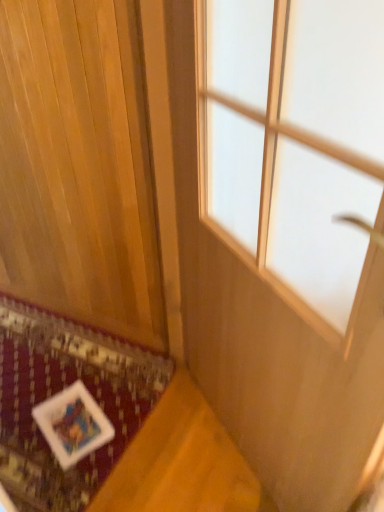
You are a GUI agent. You are given a task and a screenshot of the screen. Output one action in this format:
    pyautogui.click(x=<x>, y=<y>)
    Task: Click on the transparent glass window at center
    The image size is (384, 512).
    Given the screenshot: What is the action you would take?
    pyautogui.click(x=294, y=137)

In order to click on transparent glass window at center in this screenshot , I will do `click(294, 137)`.

Is white fabric mat at lower left smaller than transparent glass window at center?

Correct, white fabric mat at lower left occupies less space than transparent glass window at center.

Based on their positions, is white fabric mat at lower left located to the left or right of transparent glass window at center?

white fabric mat at lower left is positioned on transparent glass window at center's left side.

Is point (106, 343) positioned behind point (221, 2)?

Yes, it is.

Is transparent glass window at center surrounded by white fabric mat at lower left?

No.

Considering the sizes of objects white fabric mat at lower left and wooden panel at lower left in the image provided, who is bigger, white fabric mat at lower left or wooden panel at lower left?

wooden panel at lower left.

Consider the image. Is white fabric mat at lower left positioned far away from wooden panel at lower left?

They are positioned close to each other.

Is point (36, 350) behind point (26, 106)?

Yes, point (36, 350) is farther from viewer.

Does white fabric mat at lower left have a greater height compared to wooden panel at lower left?

No.

Is transparent glass window at center oriented towards wooden panel at lower left?

Yes.

Measure the distance between transparent glass window at center and wooden panel at lower left.

The distance of transparent glass window at center from wooden panel at lower left is 24.25 inches.

Would you say transparent glass window at center is outside wooden panel at lower left?

transparent glass window at center lies outside wooden panel at lower left's area.

From a real-world perspective, between transparent glass window at center and wooden panel at lower left, who is vertically higher?

wooden panel at lower left.

How many degrees apart are the facing directions of transparent glass window at center and white fabric mat at lower left?

The angle between the facing direction of transparent glass window at center and the facing direction of white fabric mat at lower left is 125 degrees.

Are transparent glass window at center and white fabric mat at lower left beside each other?

They are not placed beside each other.

Is point (357, 124) closer to viewer compared to point (134, 356)?

Yes.

Locate an element on the screen. The height and width of the screenshot is (512, 384). window located on the right of white fabric mat at lower left is located at coordinates (294, 137).

Is white fabric mat at lower left surrounded by wooden panel at lower left?

No, wooden panel at lower left does not contain white fabric mat at lower left.

Is point (74, 81) positioned after point (32, 401)?

No, it is not.

Is wooden panel at lower left not near white fabric mat at lower left?

wooden panel at lower left is actually quite close to white fabric mat at lower left.

Is wooden panel at lower left at the left side of white fabric mat at lower left?

No, wooden panel at lower left is not to the left of white fabric mat at lower left.

Could you tell me if wooden panel at lower left is turned towards transparent glass window at center?

Yes, wooden panel at lower left is facing transparent glass window at center.

From a real-world perspective, is wooden panel at lower left physically located above or below transparent glass window at center?

In terms of real-world spatial position, wooden panel at lower left is above transparent glass window at center.

From the image's perspective, which one is positioned higher, wooden panel at lower left or transparent glass window at center?

wooden panel at lower left, from the image's perspective.

Considering the sizes of objects wooden panel at lower left and transparent glass window at center in the image provided, who is wider, wooden panel at lower left or transparent glass window at center?

Wider between the two is transparent glass window at center.

At what (x,y) coordinates should I click in order to perform the action: click on window on the right of white fabric mat at lower left. Please return your answer as a coordinate pair (x, y). Image resolution: width=384 pixels, height=512 pixels. Looking at the image, I should click on (294, 137).

In the image, there is a wooden panel at lower left. Where is `mat below it (from the image's perspective)`? mat below it (from the image's perspective) is located at coordinates (59, 391).

Which object lies nearer to the anchor point transparent glass window at center, white fabric mat at lower left or wooden panel at lower left?

wooden panel at lower left lies closer to transparent glass window at center than the other object.

Estimate the real-world distances between objects in this image. Which object is further from wooden panel at lower left, white fabric mat at lower left or transparent glass window at center?

transparent glass window at center is further to wooden panel at lower left.

Looking at the image, which one is located closer to transparent glass window at center, wooden panel at lower left or white fabric mat at lower left?

Among the two, wooden panel at lower left is located nearer to transparent glass window at center.

Looking at the image, which one is located closer to white fabric mat at lower left, transparent glass window at center or wooden panel at lower left?

wooden panel at lower left is closer to white fabric mat at lower left.

Considering their positions, is wooden panel at lower left positioned closer to white fabric mat at lower left than transparent glass window at center?

The object closer to white fabric mat at lower left is wooden panel at lower left.

Which object lies further to the anchor point wooden panel at lower left, transparent glass window at center or white fabric mat at lower left?

transparent glass window at center is positioned further to the anchor wooden panel at lower left.

You are a GUI agent. You are given a task and a screenshot of the screen. Output one action in this format:
    pyautogui.click(x=<x>, y=<y>)
    Task: Click on the curtain between transparent glass window at center and white fabric mat at lower left in the front-back direction
    The height and width of the screenshot is (512, 384).
    Given the screenshot: What is the action you would take?
    pyautogui.click(x=78, y=166)